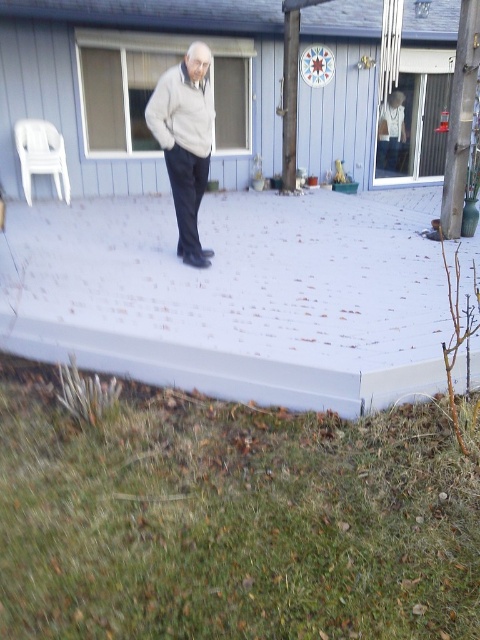
Question: Is white concrete porch at center above white matte sweater at center?

Choices:
 (A) no
 (B) yes

Answer: (A)

Question: Does white matte sweater at center have a larger size compared to white plastic chair at left?

Choices:
 (A) yes
 (B) no

Answer: (A)

Question: Which of the following is the farthest from the observer?

Choices:
 (A) (75, 566)
 (B) (177, 384)
 (C) (60, 141)

Answer: (C)

Question: Which object appears farthest from the camera in this image?

Choices:
 (A) white concrete porch at center
 (B) green grass at lower left
 (C) white plastic chair at left

Answer: (C)

Question: Which object is farther from the camera taking this photo?

Choices:
 (A) white concrete porch at center
 (B) green grass at lower left
 (C) white matte sweater at center
 (D) white plastic chair at left

Answer: (D)

Question: Is green grass at lower left to the right of white concrete porch at center from the viewer's perspective?

Choices:
 (A) yes
 (B) no

Answer: (B)